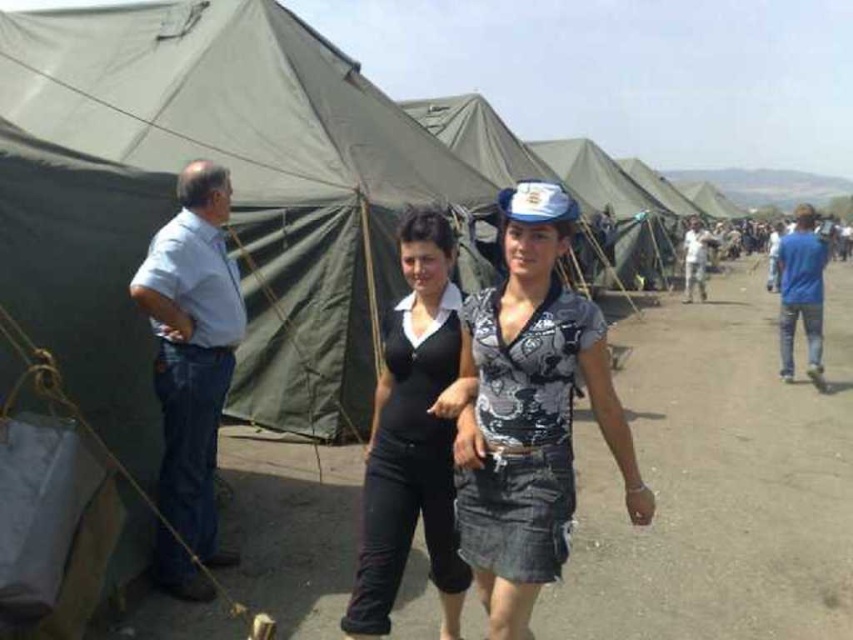
You are a photographer positioned at the camera. You want to take a photo that includes both the point at coordinates point(x=393, y=339) and point(x=686, y=282). Which point will appear larger in the photo?

Point(x=393, y=339) is closer to the camera than point(x=686, y=282), so it will appear larger in the photo.

You are standing at the point with coordinates 0.5,0.5. You want to walk to the dirt track at center. Which direction should you move in?

The dirt track at center is located at point [717,481]. Since you are at [426,320], you should move northeast to reach it.